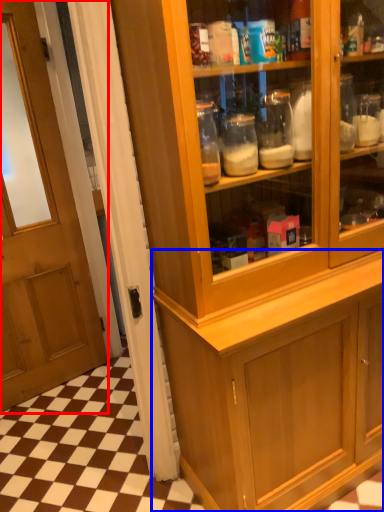
Question: Which object is further to the camera taking this photo, door (highlighted by a red box) or cabinetry (highlighted by a blue box)?

Choices:
 (A) door
 (B) cabinetry

Answer: (B)